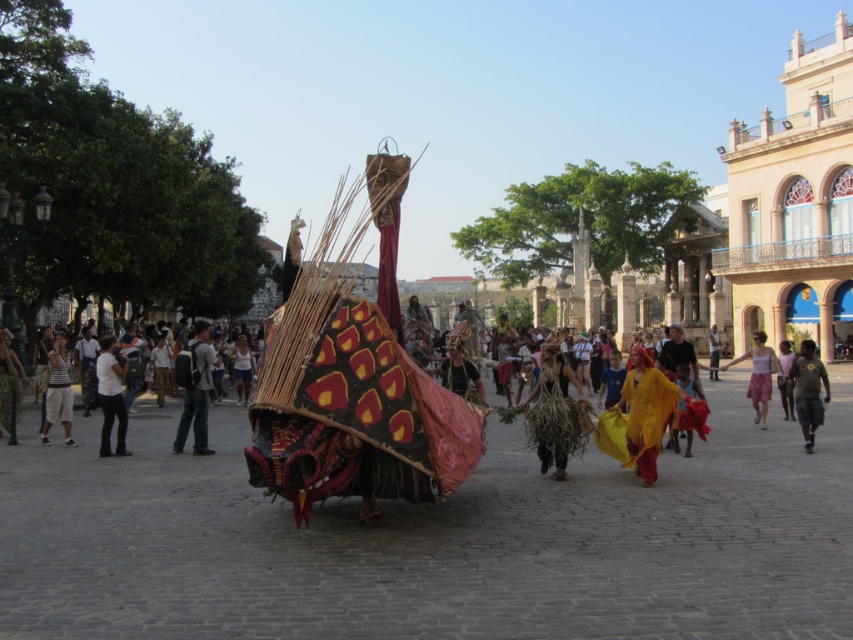
Question: Which of the following is the closest to the observer?

Choices:
 (A) matte black t-shirt at center
 (B) white cotton shirt at center
 (C) yellow cotton skirt at center

Answer: (A)

Question: Can you confirm if green leafy costume at center is positioned to the left of matte black t-shirt at center?

Choices:
 (A) yes
 (B) no

Answer: (B)

Question: Is white cotton shirt at center closer to the viewer compared to light brown fabric at center?

Choices:
 (A) yes
 (B) no

Answer: (A)

Question: Which of the following is the closest to the observer?

Choices:
 (A) light brown fabric at center
 (B) light gray backpack at center

Answer: (B)

Question: Which object is positioned farthest from the light gray backpack at center?

Choices:
 (A) white cotton shirt at center
 (B) brown cotton shirt at right
 (C) white striped shirt at left
 (D) camouflage fabric person at center

Answer: (B)

Question: Can you confirm if light gray backpack at center is positioned above camouflage fabric person at center?

Choices:
 (A) no
 (B) yes

Answer: (A)